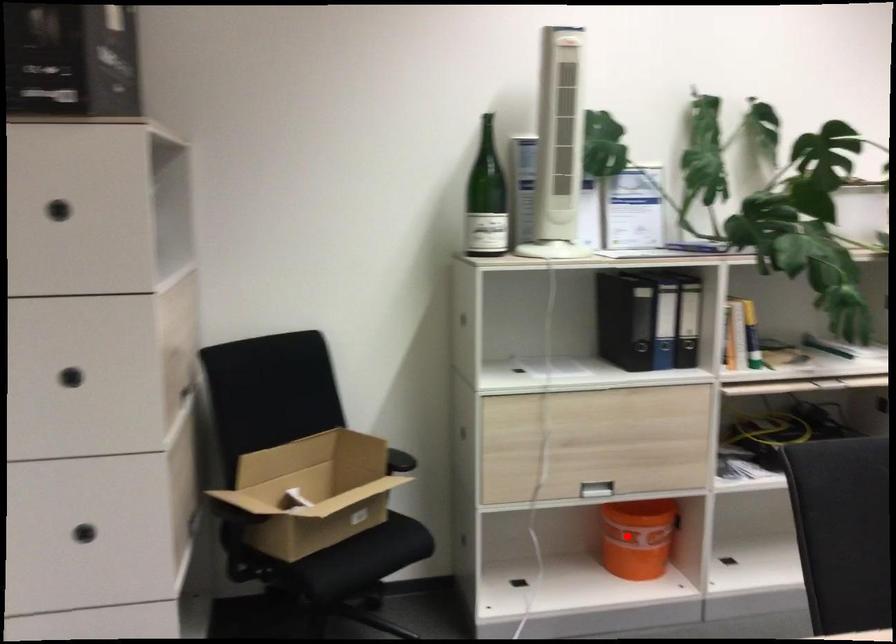
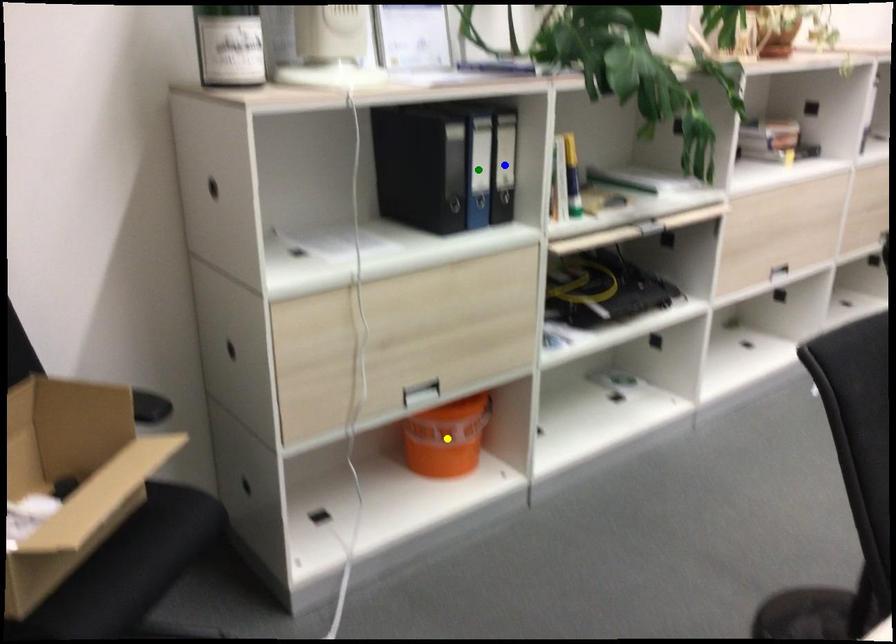
Question: I am providing you with two images of the same scene from different viewpoints. A red point is marked on the first image. You are given multiple points on the second image. Which spot in image 2 lines up with the point in image 1?

Choices:
 (A) green point
 (B) blue point
 (C) yellow point

Answer: (C)